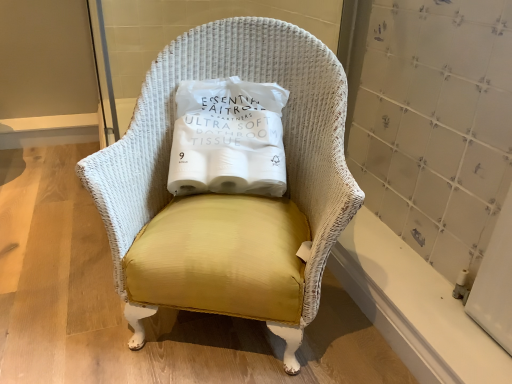
Question: Is yellow fabric pillow at center facing towards white wicker chair at center?

Choices:
 (A) yes
 (B) no

Answer: (A)

Question: Is white wicker chair at center at the back of yellow fabric pillow at center?

Choices:
 (A) yes
 (B) no

Answer: (A)

Question: Would you say yellow fabric pillow at center is a long distance from white wicker chair at center?

Choices:
 (A) no
 (B) yes

Answer: (A)

Question: From the image's perspective, is yellow fabric pillow at center located above white wicker chair at center?

Choices:
 (A) no
 (B) yes

Answer: (B)

Question: Is yellow fabric pillow at center positioned behind white wicker chair at center?

Choices:
 (A) no
 (B) yes

Answer: (B)

Question: Considering the relative sizes of yellow fabric pillow at center and white wicker chair at center in the image provided, is yellow fabric pillow at center shorter than white wicker chair at center?

Choices:
 (A) yes
 (B) no

Answer: (A)

Question: Does white wicker chair at center appear on the right side of yellow fabric pillow at center?

Choices:
 (A) yes
 (B) no

Answer: (A)

Question: Is white wicker chair at center taller than yellow fabric pillow at center?

Choices:
 (A) no
 (B) yes

Answer: (B)

Question: From the image's perspective, does white wicker chair at center appear lower than yellow fabric pillow at center?

Choices:
 (A) yes
 (B) no

Answer: (A)

Question: Is white wicker chair at center not within yellow fabric pillow at center?

Choices:
 (A) no
 (B) yes

Answer: (B)

Question: Is the depth of white wicker chair at center greater than that of yellow fabric pillow at center?

Choices:
 (A) no
 (B) yes

Answer: (A)

Question: Can you confirm if white wicker chair at center is smaller than yellow fabric pillow at center?

Choices:
 (A) yes
 (B) no

Answer: (B)

Question: In terms of height, does white wicker chair at center look taller or shorter compared to yellow fabric pillow at center?

Choices:
 (A) short
 (B) tall

Answer: (B)